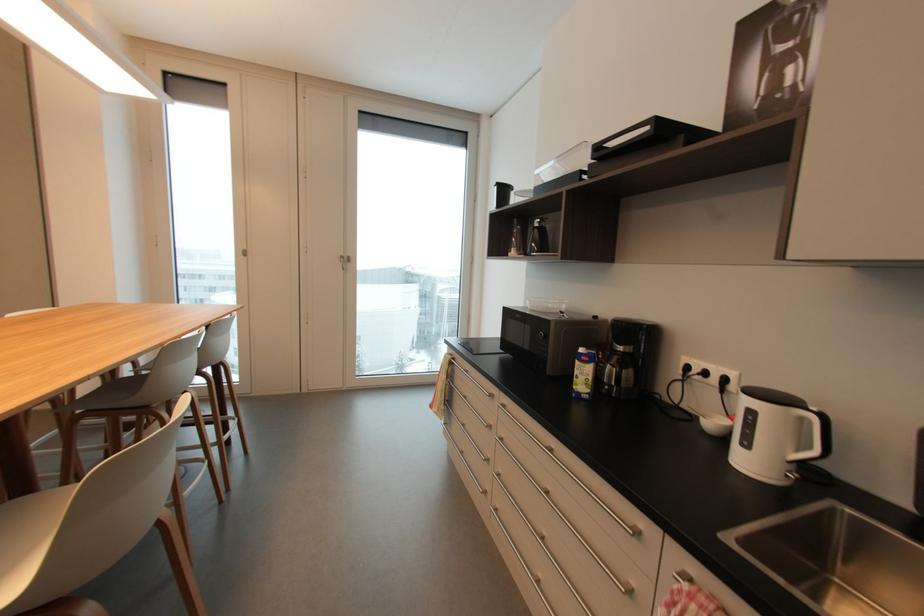
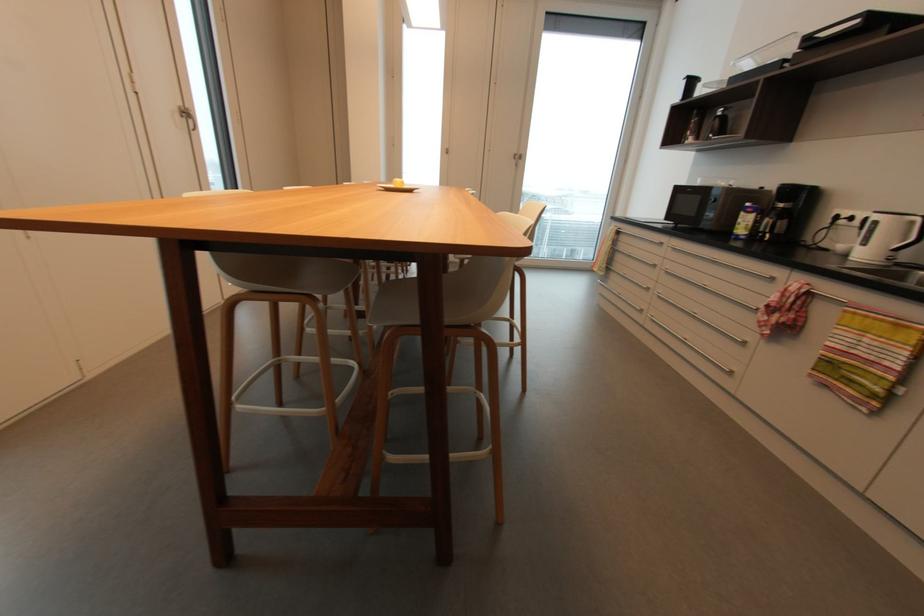
In the second image, find the point that corresponds to point 639,533 in the first image.

(775, 280)